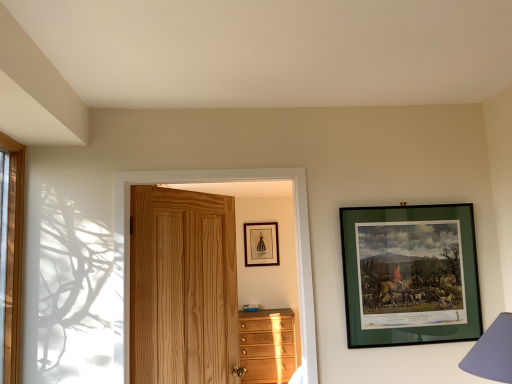
Question: Considering the positions of light brown wooden chest of drawers at lower center and purple fabric lampshade at lower right in the image, is light brown wooden chest of drawers at lower center taller or shorter than purple fabric lampshade at lower right?

Choices:
 (A) short
 (B) tall

Answer: (B)

Question: Is light brown wooden chest of drawers at lower center in front of or behind purple fabric lampshade at lower right in the image?

Choices:
 (A) front
 (B) behind

Answer: (B)

Question: Which object is positioned farthest from the purple fabric lampshade at lower right?

Choices:
 (A) light brown wooden chest of drawers at lower center
 (B) matte black picture frame at upper center, arranged as the second picture frame when viewed from the right
 (C) natural wood door at center
 (D) green matte picture frame at upper right, the 1th picture frame when ordered from right to left

Answer: (B)

Question: Estimate the real-world distances between objects in this image. Which object is closer to the natural wood door at center?

Choices:
 (A) light brown wooden chest of drawers at lower center
 (B) matte black picture frame at upper center, the 1th picture frame when ordered from back to front
 (C) purple fabric lampshade at lower right
 (D) green matte picture frame at upper right, the 1th picture frame when ordered from right to left

Answer: (D)